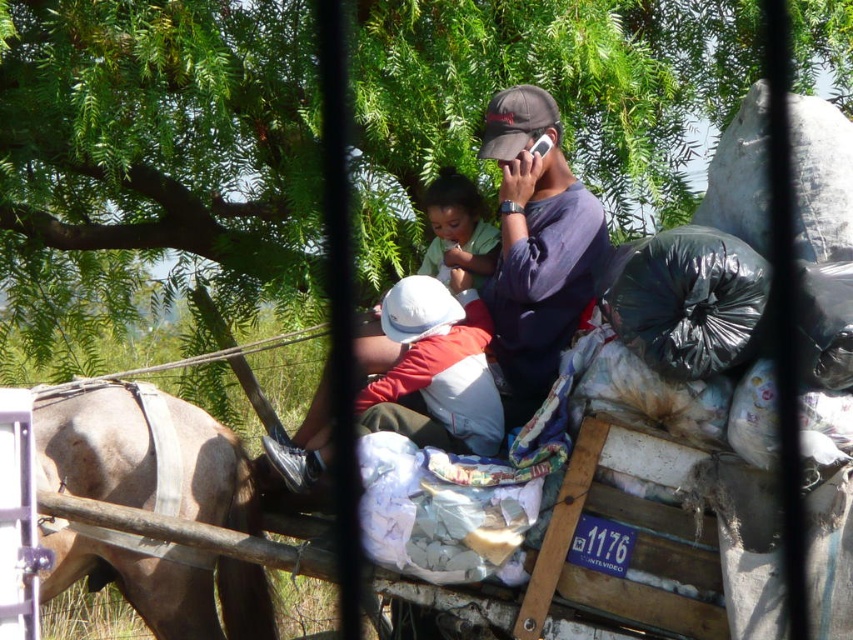
Question: Is brown leather harness at left above dark blue fabric at center?

Choices:
 (A) yes
 (B) no

Answer: (B)

Question: Is brown leather harness at left behind dark blue fabric at center?

Choices:
 (A) yes
 (B) no

Answer: (B)

Question: Is dark blue fabric at center bigger than soft white cloth at center?

Choices:
 (A) yes
 (B) no

Answer: (A)

Question: Which point is farther to the camera?

Choices:
 (A) soft white cloth at center
 (B) dark blue fabric at center

Answer: (A)

Question: Estimate the real-world distances between objects in this image. Which object is closer to the brown leather harness at left?

Choices:
 (A) dark blue fabric at center
 (B) soft white cloth at center

Answer: (A)

Question: Which object is the closest to the soft white cloth at center?

Choices:
 (A) brown leather harness at left
 (B) dark blue fabric at center

Answer: (B)